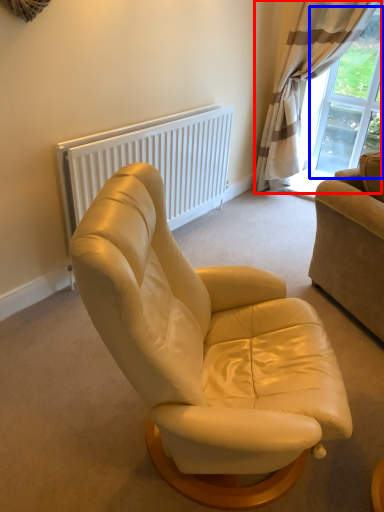
Question: Which point is closer to the camera, curtain (highlighted by a red box) or window screen (highlighted by a blue box)?

Choices:
 (A) curtain
 (B) window screen

Answer: (A)